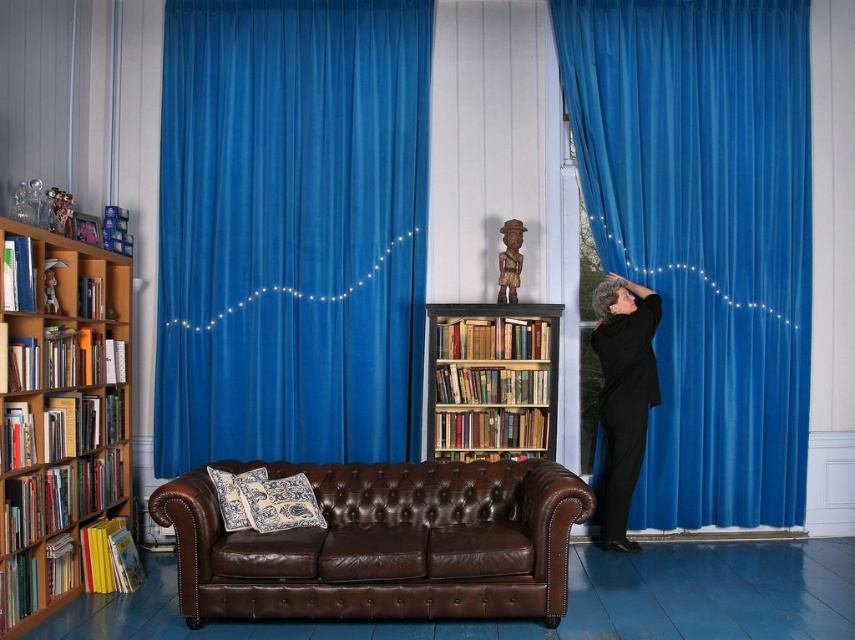
You are planning to hang a new painting that is 2 meters wide on the wall behind the brown leather couch at center. The blue velvet curtain at center is currently covering part of that wall. Can the painting be placed without overlapping the curtain?

The blue velvet curtain at center is narrower than the brown leather couch at center. Since the curtain is narrower, there might be enough space on either side of it to accommodate the 2m wide painting without overlapping. However, the exact placement depends on the total wall width and curtain position, which aren